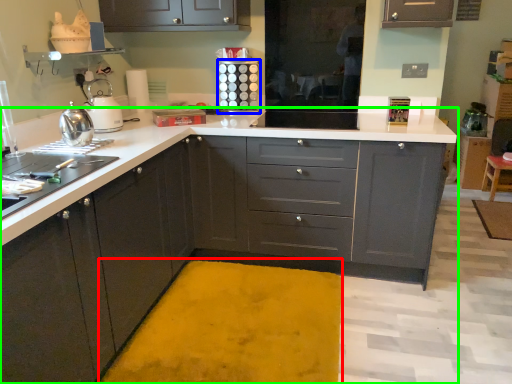
Question: Which object is the farthest from bath mat (highlighted by a red box)? Choose among these: appliance (highlighted by a blue box) or countertop (highlighted by a green box).

Choices:
 (A) appliance
 (B) countertop

Answer: (A)